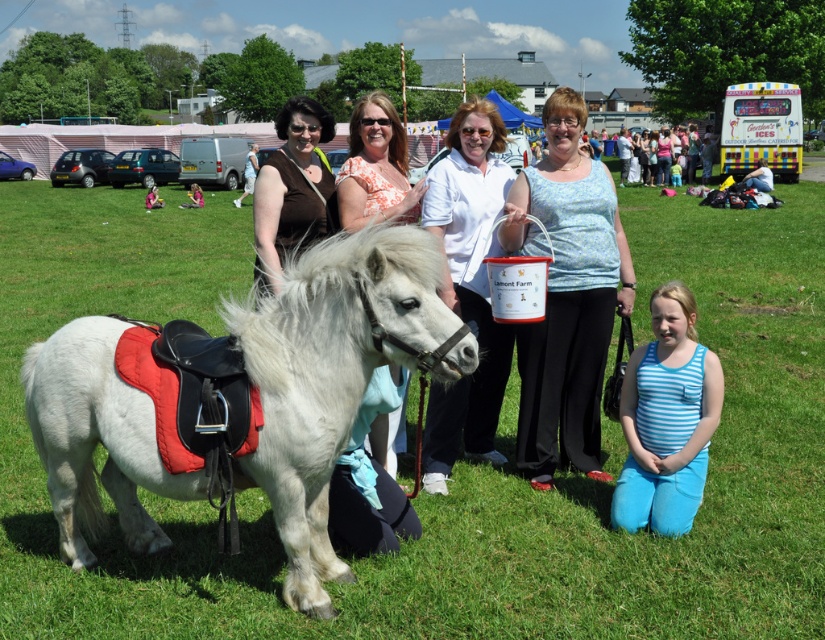
Question: Considering the real-world distances, which object is farthest from the white matte shirt at center?

Choices:
 (A) white matte horse at center
 (B) floral fabric purse at center

Answer: (A)

Question: Which of the following is the farthest from the observer?

Choices:
 (A) (667, 296)
 (B) (710, 321)

Answer: (B)

Question: In this image, where is green grass at center located relative to blue striped tank top at lower right?

Choices:
 (A) right
 (B) left

Answer: (A)

Question: Does floral fabric purse at center appear under orange floral blouse at center?

Choices:
 (A) no
 (B) yes

Answer: (B)

Question: Which point is farther from the camera taking this photo?

Choices:
 (A) (578, 240)
 (B) (291, 275)

Answer: (A)

Question: Is white matte shirt at center smaller than orange floral blouse at center?

Choices:
 (A) no
 (B) yes

Answer: (B)